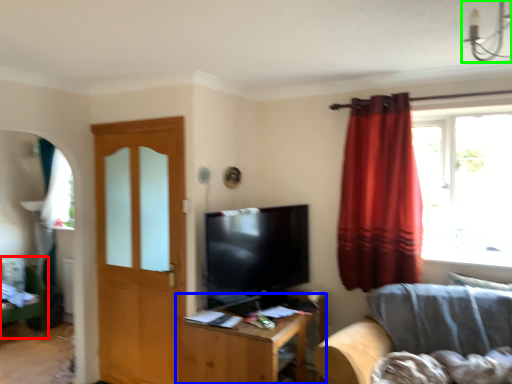
Question: Which is nearer to the swivel chair (highlighted by a red box)? table (highlighted by a blue box) or light fixture (highlighted by a green box).

Choices:
 (A) table
 (B) light fixture

Answer: (A)